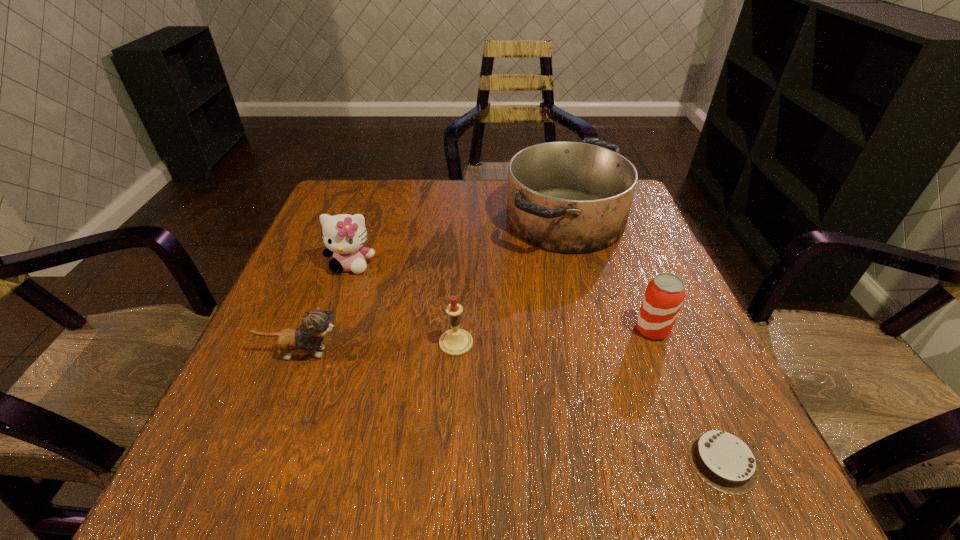
In the image, there is a desktop. Identify the location of vacant space at the far edge. The width and height of the screenshot is (960, 540). (407, 207).

Where is `vacant space at the near edge`? The height and width of the screenshot is (540, 960). vacant space at the near edge is located at coordinates (663, 486).

The width and height of the screenshot is (960, 540). In the image, there is a desktop. Identify the location of free space at the left edge. (374, 229).

This screenshot has width=960, height=540. Identify the location of vacant space at the right edge of the desktop. (611, 296).

At what (x,y) coordinates should I click in order to perform the action: click on vacant space at the far left corner of the desktop. Please return your answer as a coordinate pair (x, y). Looking at the image, I should click on 379,195.

Identify the location of free space between the saucepan and the fourth object from right to left. (511, 281).

The width and height of the screenshot is (960, 540). Find the location of `vacant region between the beer can and the shorter kitten`. vacant region between the beer can and the shorter kitten is located at coordinates (477, 341).

The width and height of the screenshot is (960, 540). What are the coordinates of `vacant space that is in between the beer can and the farther kitten` in the screenshot? It's located at (502, 297).

This screenshot has height=540, width=960. I want to click on vacant space in between the beer can and the saucepan, so click(609, 274).

Identify the location of vacant area between the saucepan and the shorter kitten. Image resolution: width=960 pixels, height=540 pixels. (434, 286).